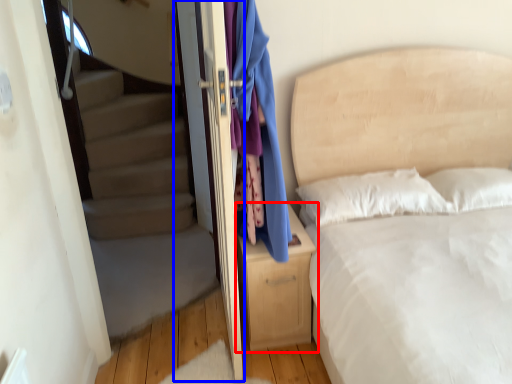
Question: Which of the following is the closest to the observer, nightstand (highlighted by a red box) or screen door (highlighted by a blue box)?

Choices:
 (A) nightstand
 (B) screen door

Answer: (B)